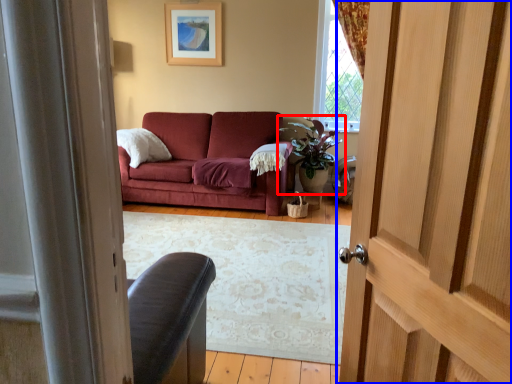
Question: Which of the following is the closest to the observer, houseplant (highlighted by a red box) or door (highlighted by a blue box)?

Choices:
 (A) houseplant
 (B) door

Answer: (B)